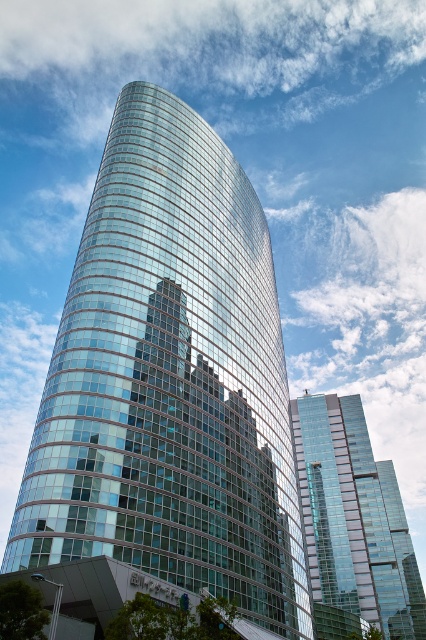
The height and width of the screenshot is (640, 426). Describe the element at coordinates (169, 380) in the screenshot. I see `transparent glass tower at center` at that location.

Can you confirm if transparent glass tower at center is positioned to the left of transparent glass skyscraper at center?

Correct, you'll find transparent glass tower at center to the left of transparent glass skyscraper at center.

Find the location of a particular element. transparent glass tower at center is located at coordinates (x=169, y=380).